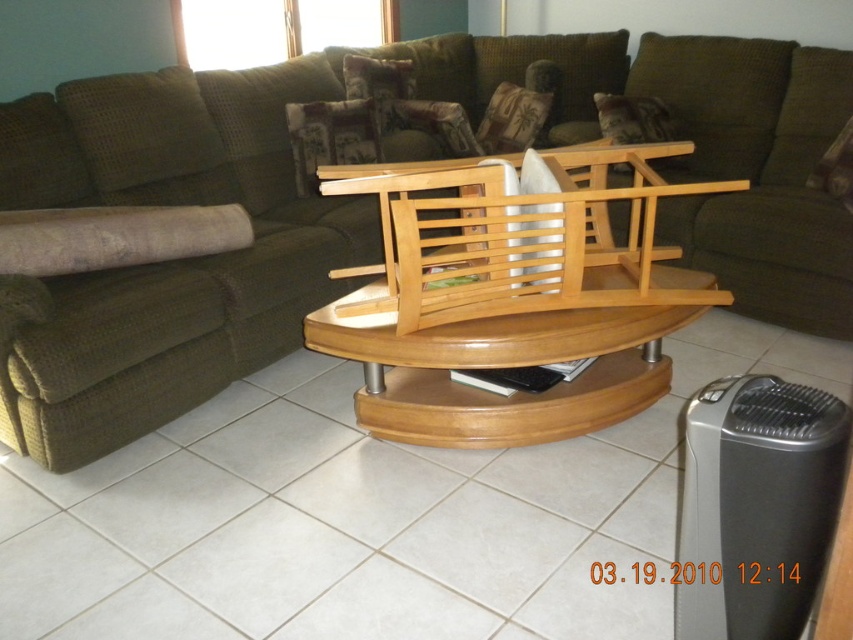
Is green fabric couch at center wider than natural wood rocking chair at center?

Yes.

Does green fabric couch at center appear over natural wood rocking chair at center?

Yes.

Which is in front, point (840, 310) or point (645, 257)?

Point (645, 257)

Where is `green fabric couch at center`? This screenshot has width=853, height=640. green fabric couch at center is located at coordinates (374, 209).

Measure the distance between point (294,348) and camera.

They are 8.51 feet apart.

Can you confirm if green fabric couch at center is wider than wooden table at center?

Indeed, green fabric couch at center has a greater width compared to wooden table at center.

Is point (225, 141) positioned behind point (503, 436)?

Yes, point (225, 141) is farther from viewer.

Find the location of `green fabric couch at center`. green fabric couch at center is located at coordinates (374, 209).

Is wooden table at center further to camera compared to natural wood rocking chair at center?

That is True.

Between wooden table at center and natural wood rocking chair at center, which one is positioned higher?

natural wood rocking chair at center is above.

At what (x,y) coordinates should I click in order to perform the action: click on wooden table at center. Please return your answer as a coordinate pair (x, y). The width and height of the screenshot is (853, 640). Looking at the image, I should click on (502, 365).

I want to click on wooden table at center, so click(x=502, y=365).